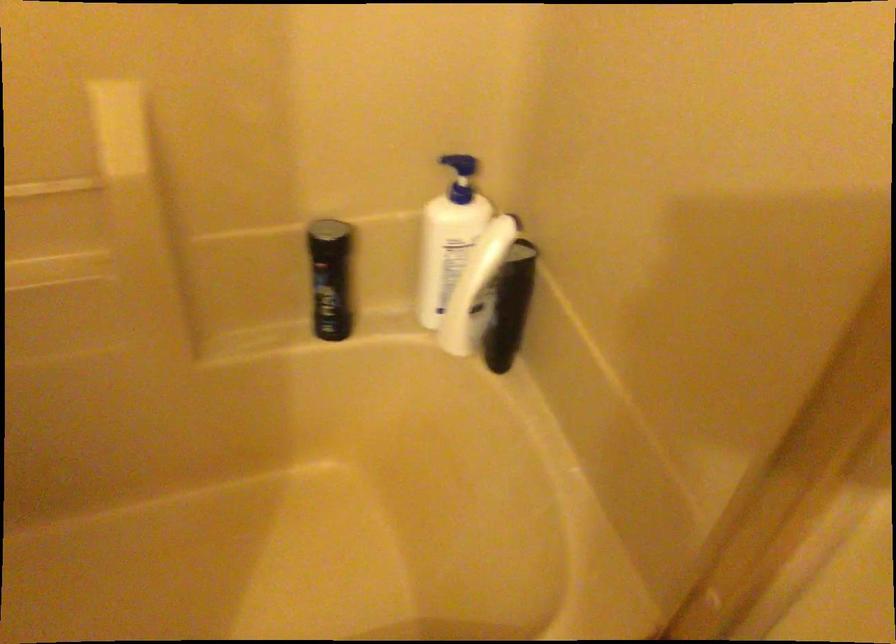
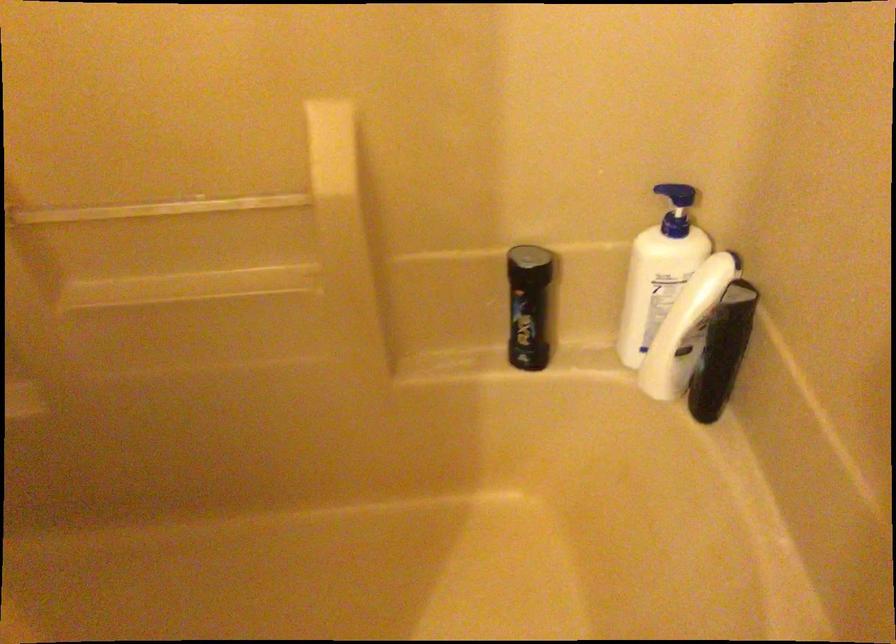
Question: Based on the continuous images, in which direction is the camera rotating? Reply with the corresponding letter.

Choices:
 (A) Left
 (B) Right
 (C) Up
 (D) Down

Answer: (A)